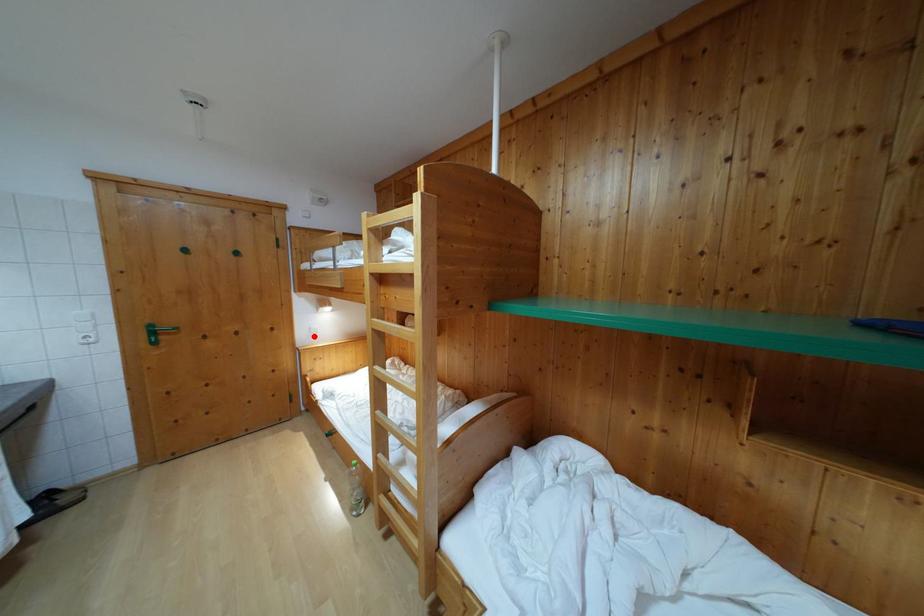
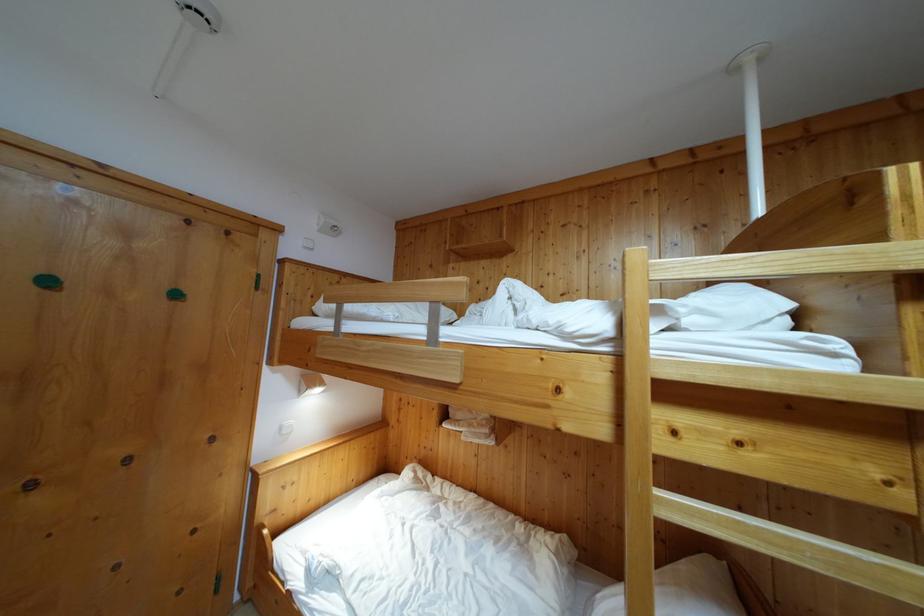
Question: I am providing you with two images of the same scene from different viewpoints. Image1 has a red point marked. In image2, the corresponding 3D location appears at what relative position? Reply with the corresponding letter.

Choices:
 (A) Closer
 (B) Farther

Answer: (B)